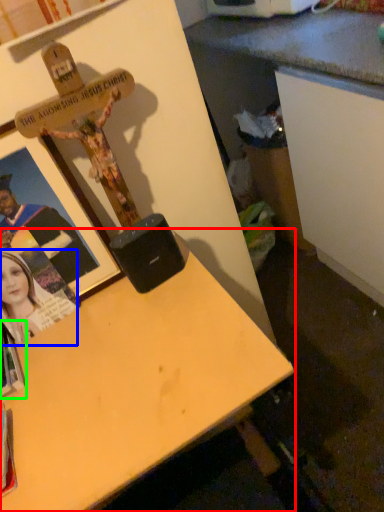
Question: Based on their relative distances, which object is farther from desk (highlighted by a red box)? Choose from person (highlighted by a blue box) and book (highlighted by a green box).

Choices:
 (A) person
 (B) book

Answer: (B)